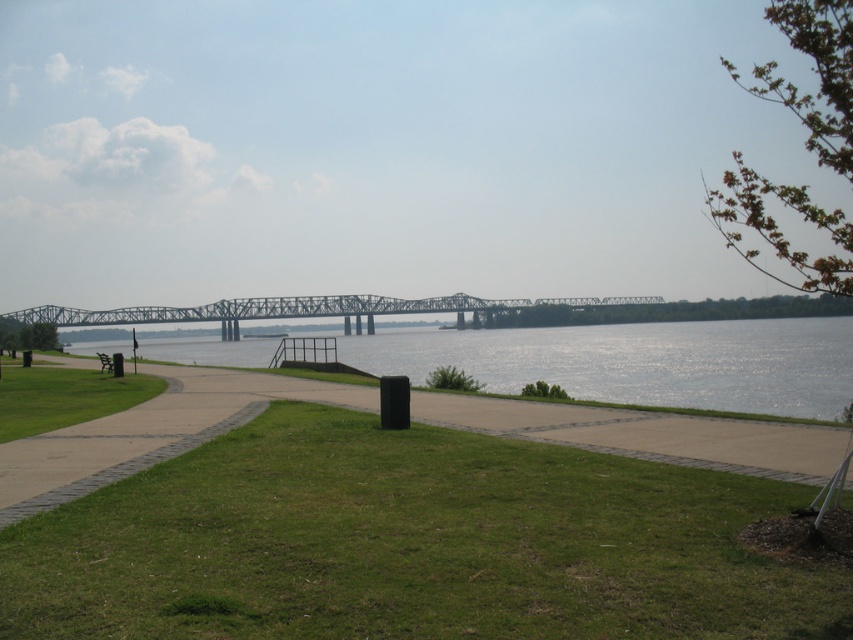
Question: Can you confirm if metallic gray bridge at center is bigger than brown wooden park bench at lower left?

Choices:
 (A) no
 (B) yes

Answer: (B)

Question: Which point is closer to the camera taking this photo?

Choices:
 (A) (289, 301)
 (B) (514, 611)

Answer: (B)

Question: Does green water at center appear on the right side of brown wooden park bench at lower left?

Choices:
 (A) yes
 (B) no

Answer: (A)

Question: Can you confirm if green grass at center is bigger than brown wooden park bench at lower left?

Choices:
 (A) no
 (B) yes

Answer: (A)

Question: Among these points, which one is farthest from the camera?

Choices:
 (A) (103, 358)
 (B) (641, 556)
 (C) (426, 348)
 (D) (157, 310)

Answer: (D)

Question: Which is farther from the brown wooden park bench at lower left?

Choices:
 (A) metallic gray bridge at center
 (B) green water at center
 (C) green grass at center

Answer: (A)